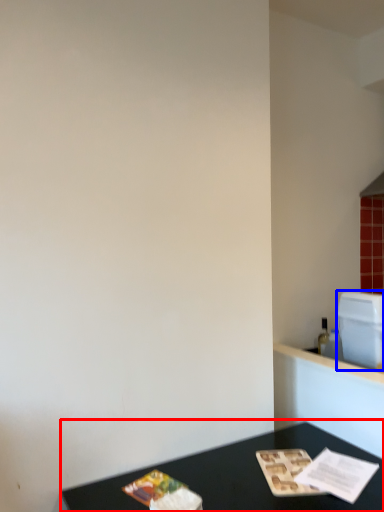
Question: Which object is further to the camera taking this photo, table (highlighted by a red box) or appliance (highlighted by a blue box)?

Choices:
 (A) table
 (B) appliance

Answer: (B)